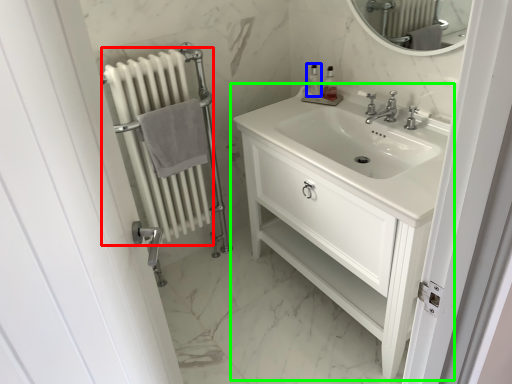
Question: Which is farther away from radiator (highlighted by a red box)? soap dispenser (highlighted by a blue box) or bathroom cabinet (highlighted by a green box)?

Choices:
 (A) soap dispenser
 (B) bathroom cabinet

Answer: (A)